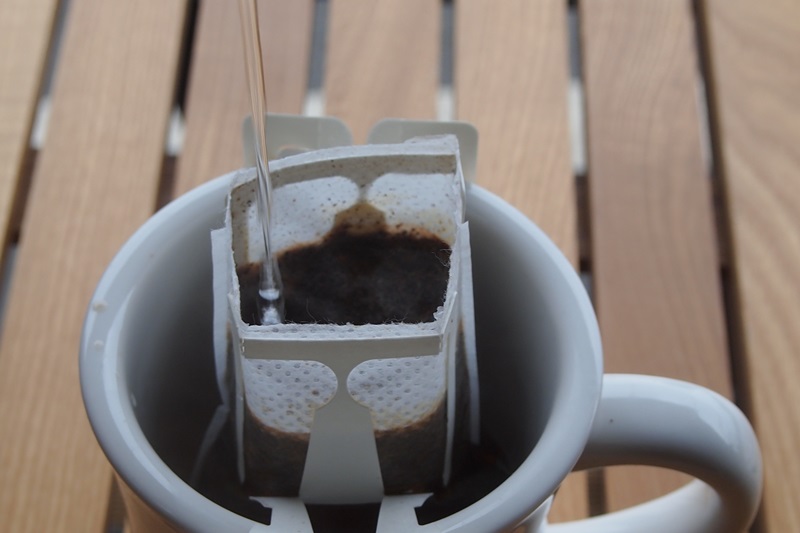
I want to click on white beam, so click(33, 124), click(174, 132), click(314, 100), click(446, 101), click(574, 108).